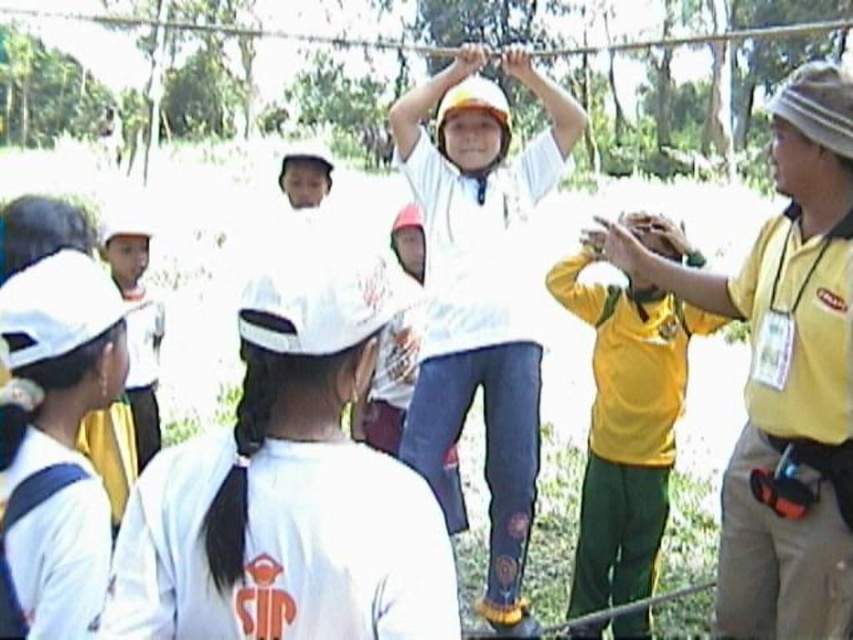
Is point (801, 595) more distant than point (424, 625)?

Yes, point (801, 595) is behind point (424, 625).

Between point (757, 618) and point (373, 484), which one is positioned in front?

Point (373, 484) is more forward.

This screenshot has width=853, height=640. In order to click on yellow fabric shirt at right in this screenshot , I will do `click(785, 376)`.

Which of these two, yellow fabric badge at right or white matte hoodie at center, stands shorter?

yellow fabric badge at right is shorter.

Is yellow fabric badge at right below white matte hoodie at center?

Yes, yellow fabric badge at right is below white matte hoodie at center.

Which is behind, point (827, 474) or point (418, 452)?

The point (418, 452) is more distant.

The width and height of the screenshot is (853, 640). Identify the location of yellow fabric badge at right. (790, 438).

Is the position of white matte shirt at center more distant than that of white matte hoodie at center?

No, it is not.

Is point (152, 497) positioned in front of point (461, 515)?

Yes.

I want to click on white matte shirt at center, so click(x=283, y=548).

At what (x,y) coordinates should I click in order to perform the action: click on white matte shirt at center. Please return your answer as a coordinate pair (x, y). Looking at the image, I should click on (283, 548).